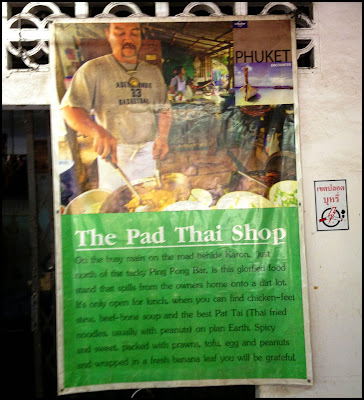
I want to click on wall, so click(x=331, y=302).